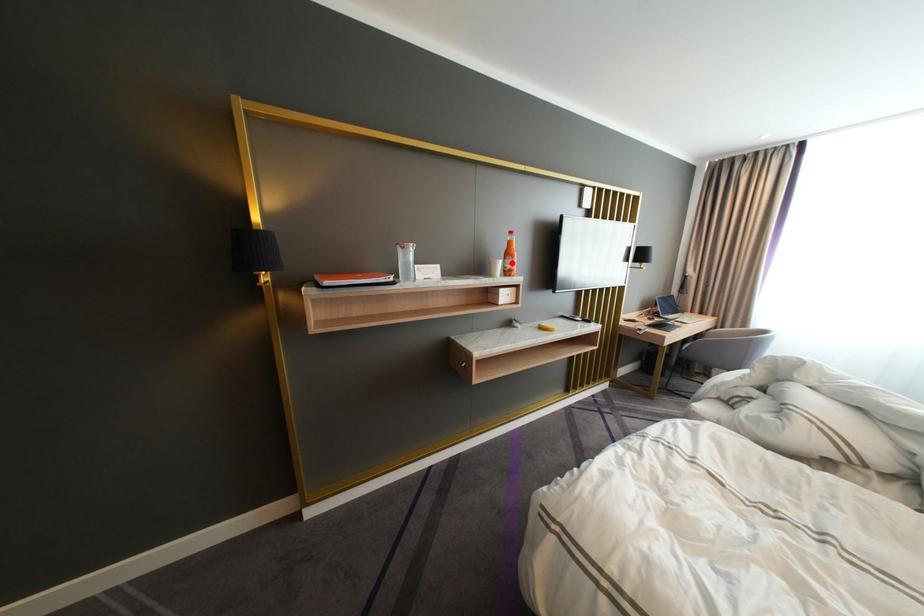
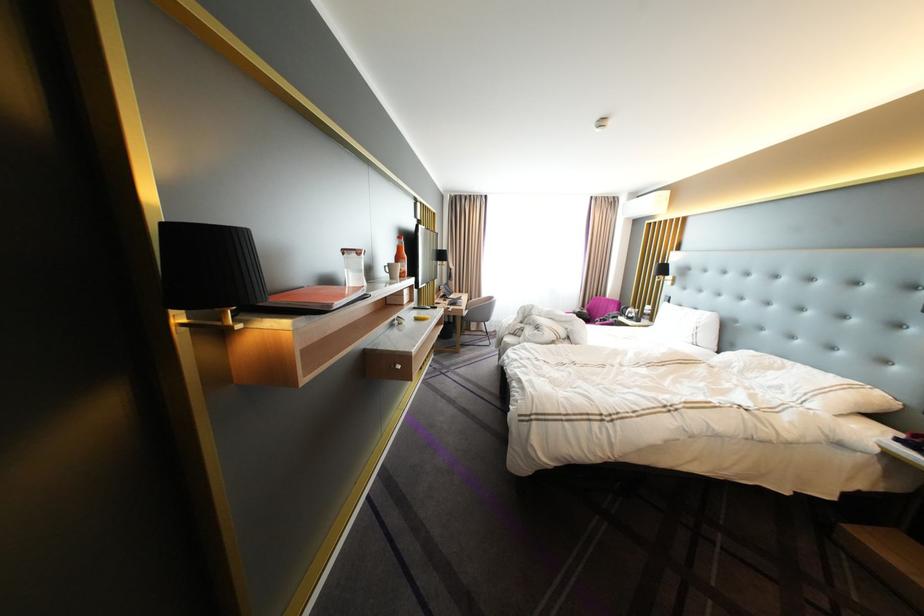
Question: I am providing you with two images of the same scene from different viewpoints. Image1 has a red point marked. In image2, the corresponding 3D location appears at what relative position? Reply with the corresponding letter.

Choices:
 (A) Closer
 (B) Farther

Answer: (A)